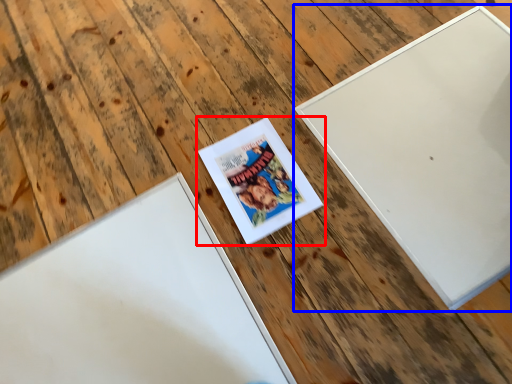
Question: Which of the following is the closest to the observer, picture frame (highlighted by a red box) or picture frame (highlighted by a blue box)?

Choices:
 (A) picture frame
 (B) picture frame

Answer: (B)